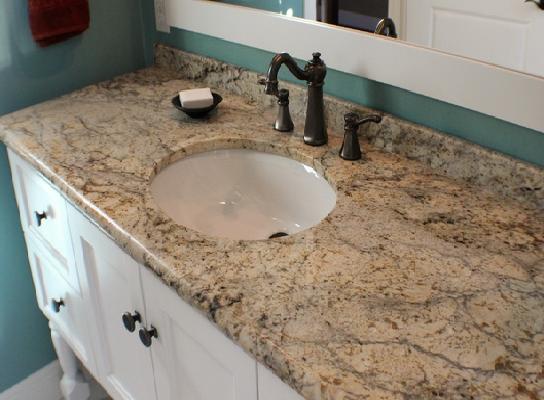
Find the location of a particular element. Image resolution: width=544 pixels, height=400 pixels. left front cabinet leg is located at coordinates (66, 365).